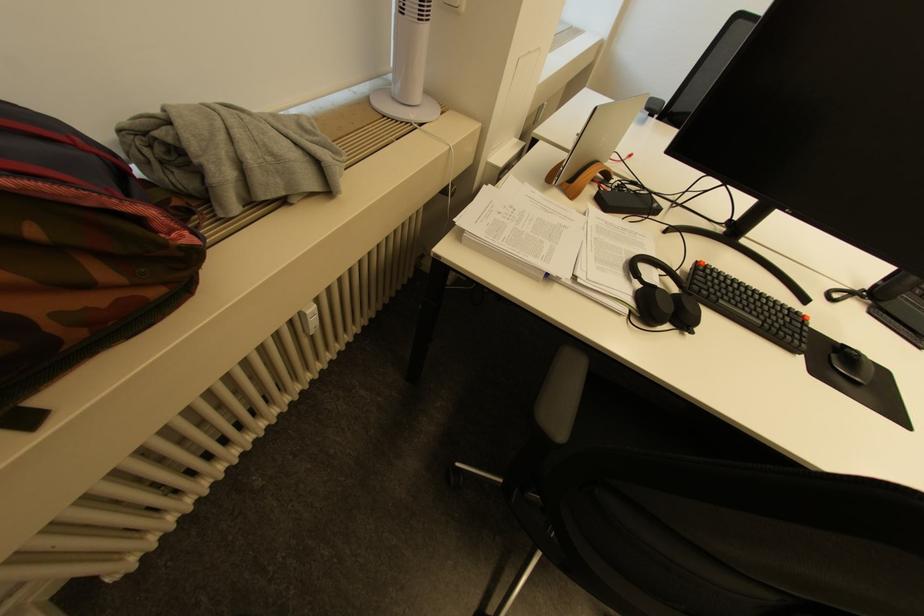
Find the location of a particular element. The height and width of the screenshot is (616, 924). laptop computer is located at coordinates (598, 138).